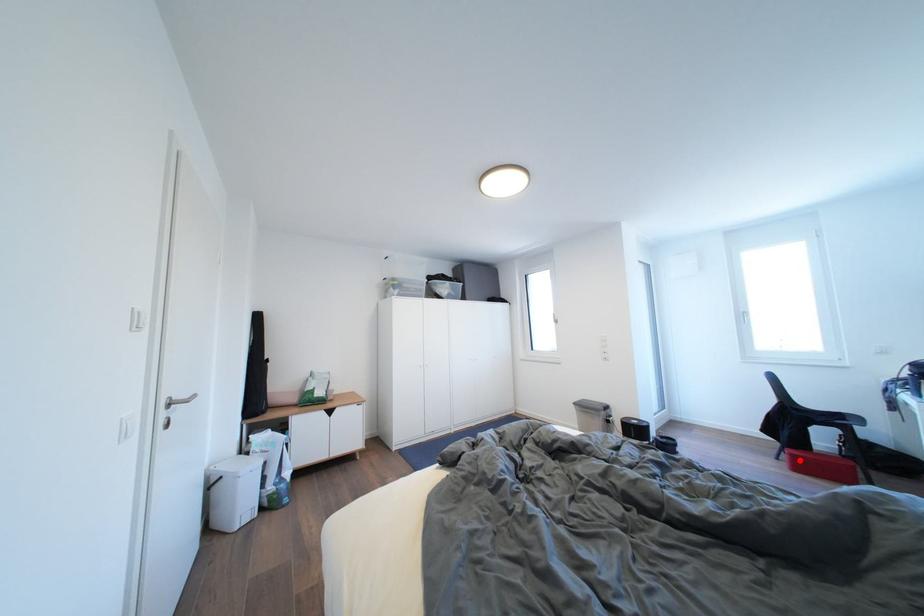
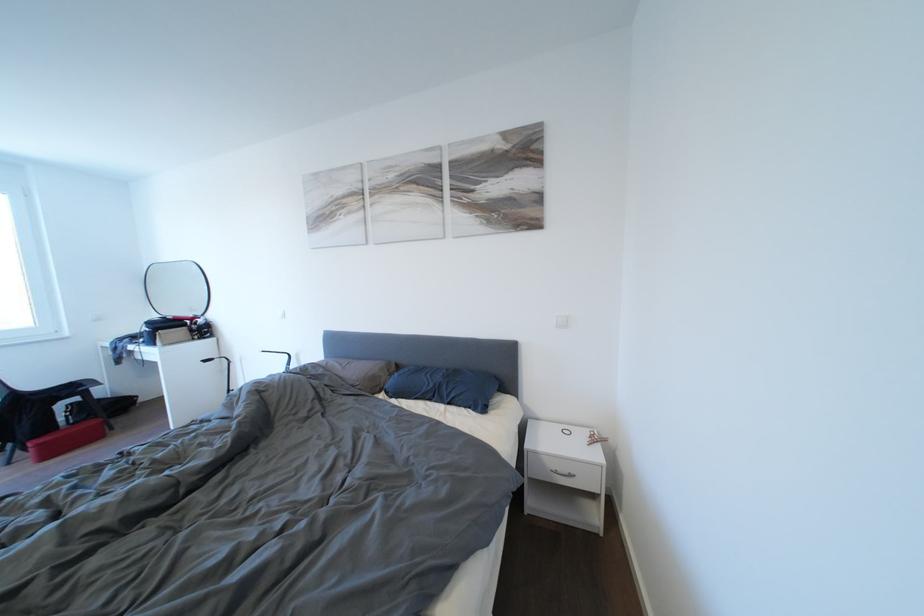
Where in the second image is the point corresponding to the highlighted location from the first image?

(46, 450)